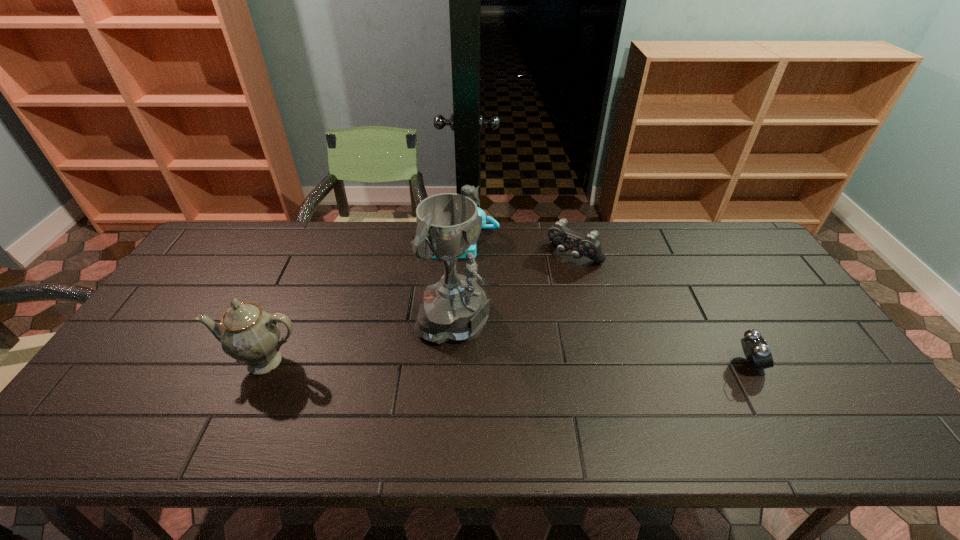
Find the location of a particular element. vacant space on the desktop that is between the second tallest object and the alarm clock and is positioned on the surface of the fourth object from left to right with buttons is located at coordinates (475, 362).

I want to click on free space on the desktop that is between the chinaware and the rightmost object and is positioned on the dial of the third tallest object, so click(x=456, y=362).

Where is `free space on the desktop that is between the chinaware and the alarm clock and is positioned on the side with emblem of the tallest object`? free space on the desktop that is between the chinaware and the alarm clock and is positioned on the side with emblem of the tallest object is located at coordinates (540, 363).